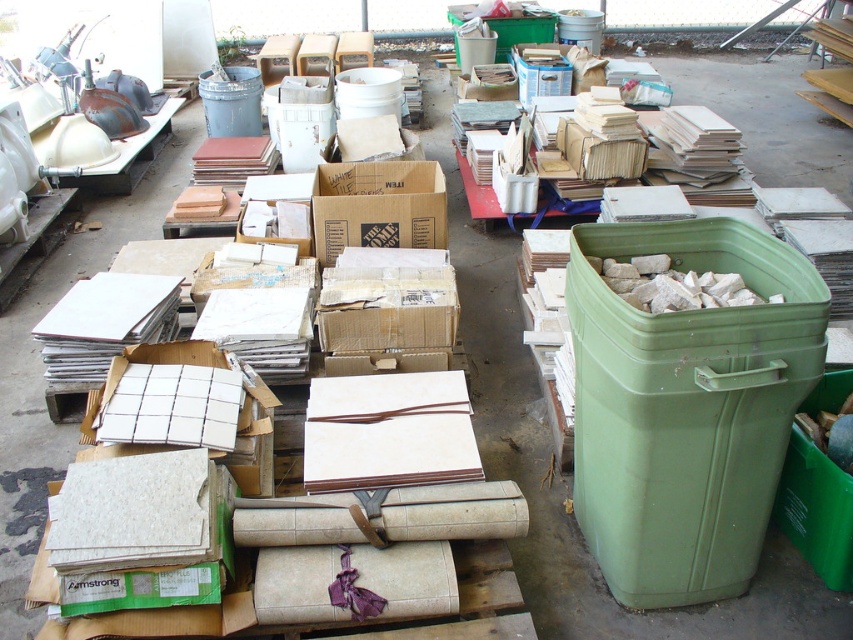
Question: Can you confirm if green plastic recycling bin at right is thinner than cardboard box at center?

Choices:
 (A) yes
 (B) no

Answer: (A)

Question: Can you confirm if green plastic recycling bin at right is positioned below metallic gray trash can at upper left?

Choices:
 (A) no
 (B) yes

Answer: (B)

Question: Among these objects, which one is farthest from the camera?

Choices:
 (A) metallic gray trash can at upper left
 (B) green plastic recycling bin at right
 (C) cardboard box at center

Answer: (A)

Question: Which object appears closest to the camera in this image?

Choices:
 (A) cardboard box at center
 (B) metallic gray trash can at upper left

Answer: (A)

Question: Observing the image, what is the correct spatial positioning of green plastic recycling bin at right in reference to metallic gray trash can at upper left?

Choices:
 (A) above
 (B) below

Answer: (B)

Question: Which of the following is the farthest from the observer?

Choices:
 (A) green plastic recycling bin at right
 (B) cardboard box at center
 (C) metallic gray trash can at upper left

Answer: (C)